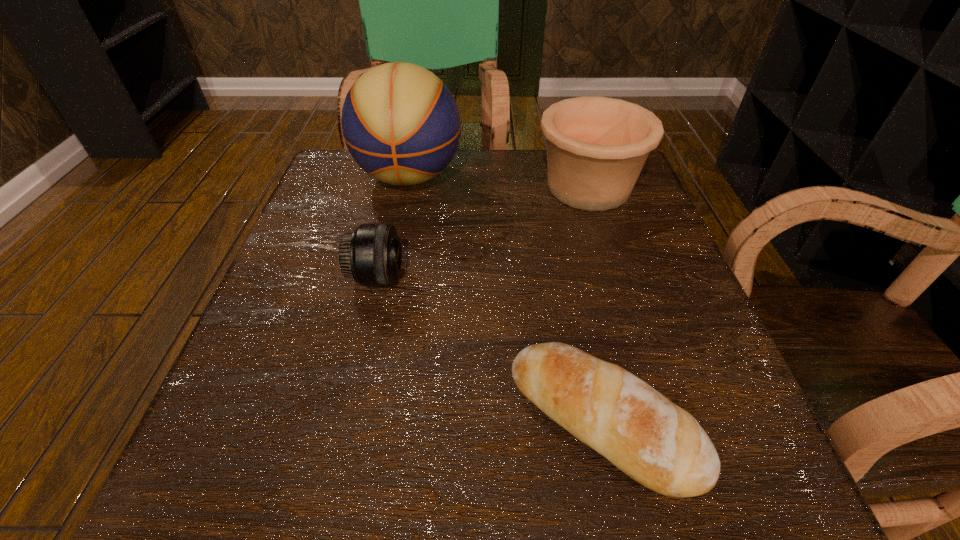
You are a GUI agent. You are given a task and a screenshot of the screen. Output one action in this format:
    pyautogui.click(x=<x>, y=<y>)
    Task: Click on the free space between the tallest object and the second tallest object
    Image resolution: width=960 pixels, height=540 pixels.
    Given the screenshot: What is the action you would take?
    pyautogui.click(x=499, y=182)

Locate an element on the screen. Image resolution: width=960 pixels, height=540 pixels. unoccupied position between the bread and the pottery is located at coordinates (595, 304).

The image size is (960, 540). What are the coordinates of `object that stands as the third closest to the bread` in the screenshot? It's located at (401, 124).

Locate an element on the screen. The image size is (960, 540). object that stands as the second closest to the pottery is located at coordinates (371, 254).

This screenshot has width=960, height=540. I want to click on free space that satisfies the following two spatial constraints: 1. on the patterned surface of the basketball; 2. on the right side of the bread, so click(x=358, y=420).

The height and width of the screenshot is (540, 960). Identify the location of free region that satisfies the following two spatial constraints: 1. on the front-facing side of the second nearest object; 2. on the left side of the bread. 344,420.

This screenshot has height=540, width=960. I want to click on vacant space that satisfies the following two spatial constraints: 1. on the patterned surface of the tallest object; 2. on the front-facing side of the telephoto lens, so click(x=388, y=278).

Locate an element on the screen. The height and width of the screenshot is (540, 960). free region that satisfies the following two spatial constraints: 1. on the patterned surface of the basketball; 2. on the front-facing side of the telephoto lens is located at coordinates (388, 278).

At what (x,y) coordinates should I click in order to perform the action: click on vacant space that satisfies the following two spatial constraints: 1. on the front-facing side of the bread; 2. on the right side of the second nearest object. Please return your answer as a coordinate pair (x, y). Image resolution: width=960 pixels, height=540 pixels. Looking at the image, I should click on (344, 420).

At what (x,y) coordinates should I click in order to perform the action: click on vacant area that satisfies the following two spatial constraints: 1. on the patterned surface of the basketball; 2. on the left side of the third shortest object. Please return your answer as a coordinate pair (x, y). Looking at the image, I should click on (407, 187).